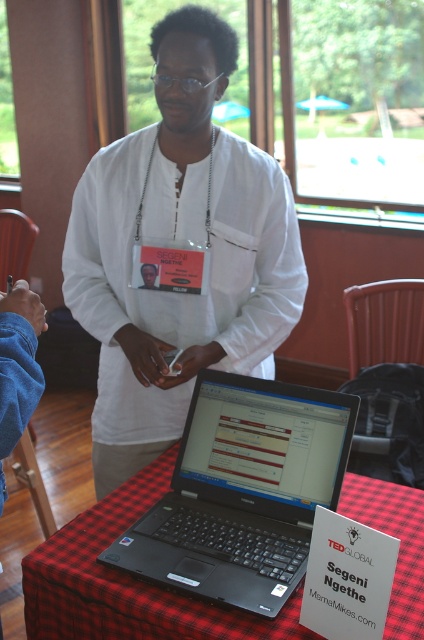
You are a photographer taking a picture of the white matte shirt at center and the matte white id card at center. Which object is wider?

The white matte shirt at center is wider than the matte white id card at center.

You are a delivery robot that needs to place a small package between the white matte shirt at center and the black plastic laptop at center. The package is 40 centimeters long. Can you fit it there?

The distance between the white matte shirt at center and the black plastic laptop at center is 41.29 centimeters. Since the package is 40 centimeters long, it can fit in the space between them.